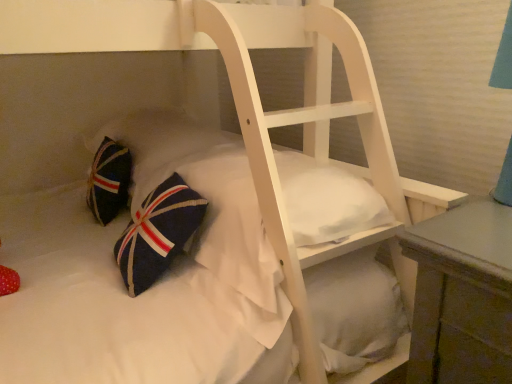
Question: Is navy blue fabric pillow at lower left outside navy blue fabric pillow at lower left?

Choices:
 (A) yes
 (B) no

Answer: (A)

Question: From a real-world perspective, is navy blue fabric pillow at lower left beneath navy blue fabric pillow at lower left?

Choices:
 (A) yes
 (B) no

Answer: (A)

Question: Can you confirm if navy blue fabric pillow at lower left is positioned to the left of navy blue fabric pillow at lower left?

Choices:
 (A) no
 (B) yes

Answer: (A)

Question: Is navy blue fabric pillow at lower left positioned before navy blue fabric pillow at lower left?

Choices:
 (A) no
 (B) yes

Answer: (B)

Question: Can you confirm if navy blue fabric pillow at lower left is positioned to the right of navy blue fabric pillow at lower left?

Choices:
 (A) yes
 (B) no

Answer: (A)

Question: Can you confirm if navy blue fabric pillow at lower left is smaller than navy blue fabric pillow at lower left?

Choices:
 (A) yes
 (B) no

Answer: (A)

Question: Is navy blue fabric pillow at lower left at the left side of navy blue fabric pillow at lower left?

Choices:
 (A) yes
 (B) no

Answer: (A)

Question: Is navy blue fabric pillow at lower left to the right of navy blue fabric pillow at lower left from the viewer's perspective?

Choices:
 (A) no
 (B) yes

Answer: (A)

Question: Is navy blue fabric pillow at lower left facing away from navy blue fabric pillow at lower left?

Choices:
 (A) no
 (B) yes

Answer: (A)

Question: Considering the relative sizes of navy blue fabric pillow at lower left and navy blue fabric pillow at lower left in the image provided, is navy blue fabric pillow at lower left wider than navy blue fabric pillow at lower left?

Choices:
 (A) yes
 (B) no

Answer: (A)

Question: Does navy blue fabric pillow at lower left have a smaller size compared to navy blue fabric pillow at lower left?

Choices:
 (A) yes
 (B) no

Answer: (B)

Question: Is navy blue fabric pillow at lower left further to camera compared to navy blue fabric pillow at lower left?

Choices:
 (A) yes
 (B) no

Answer: (A)

Question: Would you say navy blue fabric pillow at lower left is to the left or to the right of navy blue fabric pillow at lower left in the picture?

Choices:
 (A) right
 (B) left

Answer: (A)